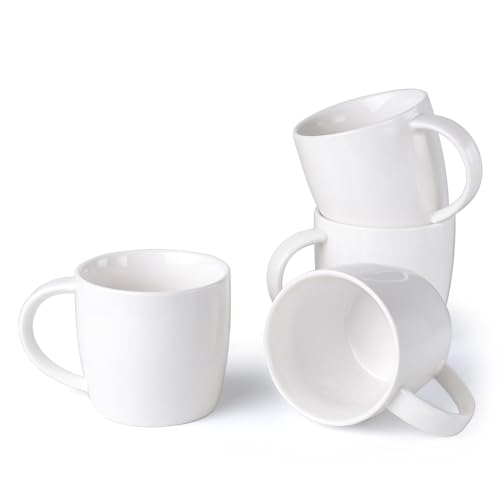
Locate an element on the screen. This screenshot has width=500, height=500. white mugs is located at coordinates (153, 340), (355, 363), (404, 173), (437, 249).